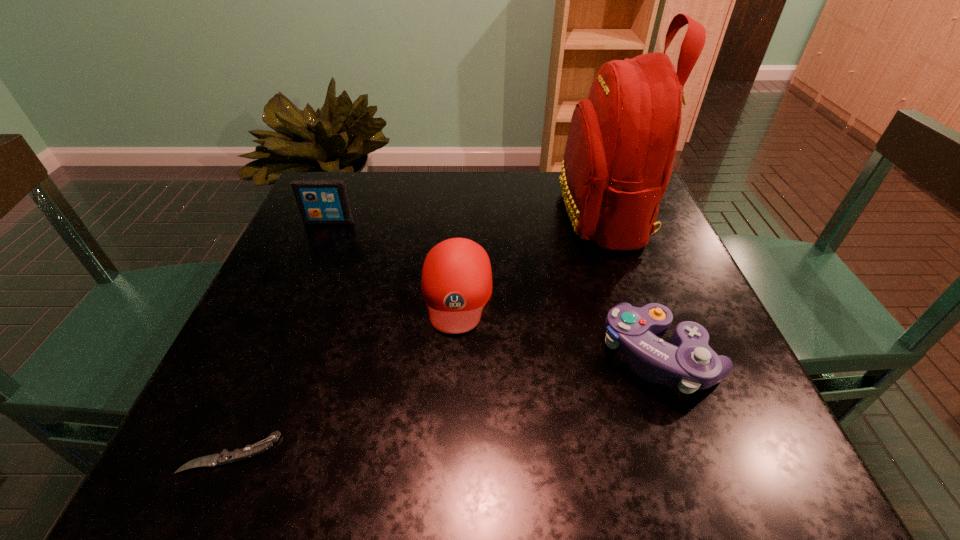
The height and width of the screenshot is (540, 960). Identify the location of vacant area that lies between the iPod and the shortest object. (279, 337).

The width and height of the screenshot is (960, 540). I want to click on free area in between the iPod and the pocketknife, so click(x=279, y=337).

You are a GUI agent. You are given a task and a screenshot of the screen. Output one action in this format:
    pyautogui.click(x=<x>, y=<y>)
    Task: Click on the vacant region between the nearest object and the control
    
    Given the screenshot: What is the action you would take?
    [445, 404]

The image size is (960, 540). I want to click on empty location between the backpack and the control, so click(x=632, y=285).

You are a GUI agent. You are given a task and a screenshot of the screen. Output one action in this format:
    pyautogui.click(x=<x>, y=<y>)
    Task: Click on the free space between the control and the shortest object
    
    Given the screenshot: What is the action you would take?
    pyautogui.click(x=445, y=404)

In order to click on free spot between the third object from left to right and the shortest object in this screenshot , I will do `click(344, 373)`.

Identify the location of empty space between the control and the pocketknife. This screenshot has height=540, width=960. (445, 404).

I want to click on the second closest object relative to the baseball cap, so (689, 361).

At what (x,y) coordinates should I click in order to perform the action: click on the fourth closest object relative to the control. Please return your answer as a coordinate pair (x, y). Looking at the image, I should click on (320, 201).

The height and width of the screenshot is (540, 960). I want to click on blank space that satisfies the following two spatial constraints: 1. on the front-facing side of the third object from right to left; 2. on the left side of the control, so click(x=453, y=356).